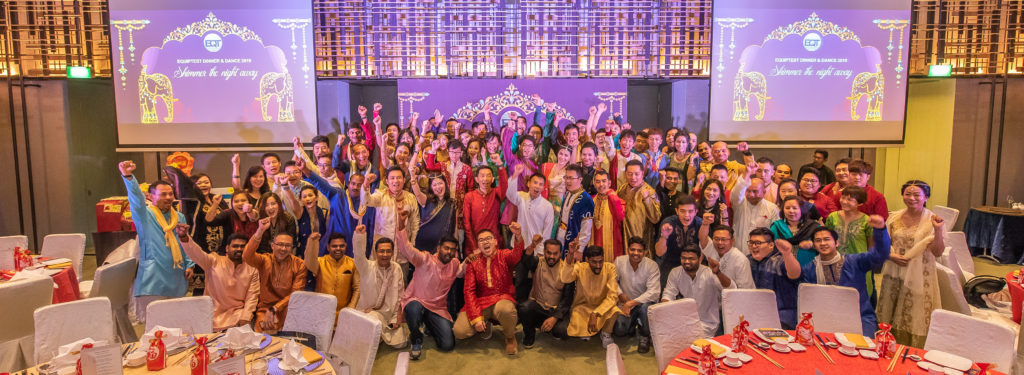
The image size is (1024, 375). In order to click on chairs in this screenshot , I will do `click(81, 322)`, `click(177, 323)`, `click(288, 303)`, `click(341, 332)`, `click(682, 320)`, `click(761, 300)`, `click(821, 301)`, `click(968, 328)`.